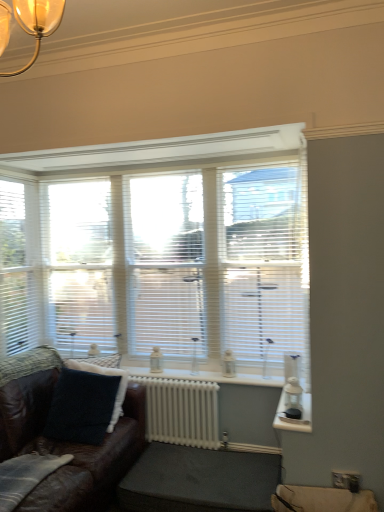
Question: Considering the positions of dark gray fabric footrest at lower center and brown leather couch at lower left in the image, is dark gray fabric footrest at lower center bigger or smaller than brown leather couch at lower left?

Choices:
 (A) big
 (B) small

Answer: (B)

Question: Considering the relative positions of dark gray fabric footrest at lower center and brown leather couch at lower left in the image provided, is dark gray fabric footrest at lower center to the left or to the right of brown leather couch at lower left?

Choices:
 (A) right
 (B) left

Answer: (A)

Question: Based on their relative distances, which object is nearer to the brown leather couch at lower left?

Choices:
 (A) dark blue fabric pillow at lower left
 (B) white painted metal radiator at center
 (C) dark gray fabric footrest at lower center
 (D) white plastic blinds at left
 (E) white blinds at center

Answer: (A)

Question: Considering the real-world distances, which object is farthest from the white plastic blinds at left?

Choices:
 (A) dark gray fabric footrest at lower center
 (B) white painted metal radiator at center
 (C) white blinds at center
 (D) brown leather couch at lower left
 (E) transparent plastic glass door at center

Answer: (A)